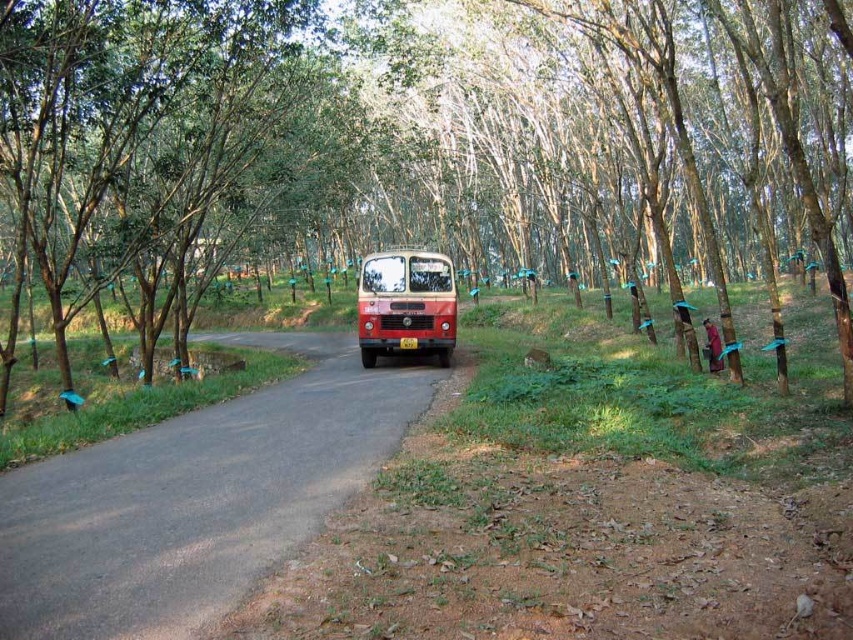
You are a hiker standing at the starting point of the forest trail. You see two points marked on the map as point 1 at coordinates point (122,627) and point 2 at coordinates point (404,323). Which point is closer to your current position?

Point (122,627) is closer to the camera than point (404,323), so the point closer to your current position is point (122,627).

You are a hiker walking along the smooth asphalt road at center and want to reach the brown smooth tree at center. Which direction should you walk to get closer to the tree?

The brown smooth tree at center is closer to you than the smooth asphalt road at center, so you should walk forward along the smooth asphalt road at center to reach the tree.

You are a pedestrian standing on the smooth asphalt road at center. You see the matte red bus at center approaching from behind. Where should you step to get out of the road safely?

The smooth asphalt road at center is positioned under the matte red bus at center, so you should step onto the bare earth on the right side of the road to get out of the way safely.